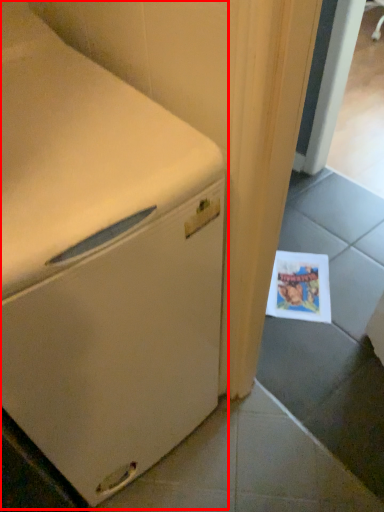
Question: In this image, where is home appliance (annotated by the red box) located relative to postcard?

Choices:
 (A) left
 (B) right

Answer: (A)